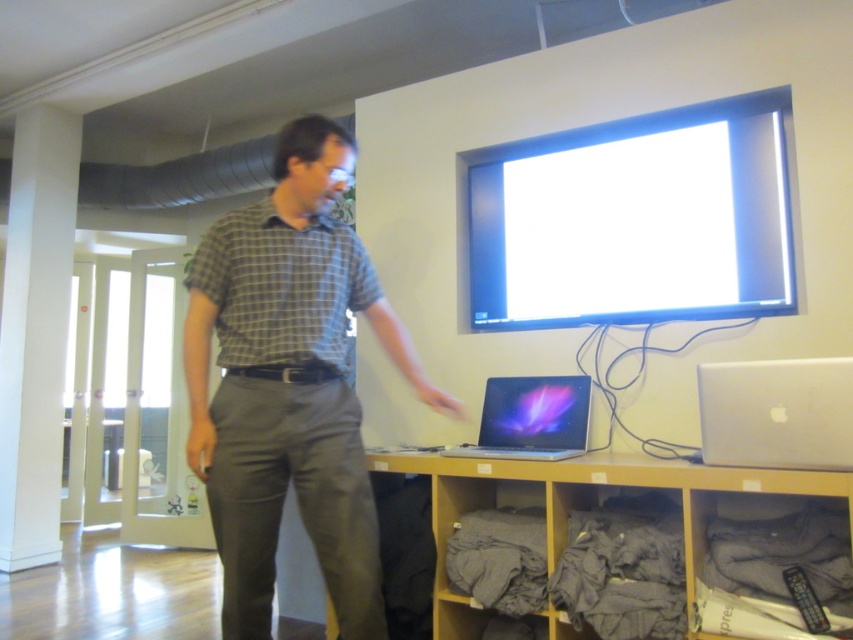
Question: Which point is farther to the camera?

Choices:
 (A) (636, 177)
 (B) (16, 496)
 (C) (547, 452)
 (D) (850, 440)

Answer: (B)

Question: Is plaid shirt at center to the right of white smooth pillar at left from the viewer's perspective?

Choices:
 (A) no
 (B) yes

Answer: (B)

Question: Which object is closer to the camera taking this photo?

Choices:
 (A) glossy plastic laptop at lower center
 (B) plaid shirt at center
 (C) wooden shelf at lower center

Answer: (B)

Question: Is white glossy screen at upper center closer to camera compared to silver metallic laptop at lower right?

Choices:
 (A) yes
 (B) no

Answer: (B)

Question: Which point is farther to the camera?

Choices:
 (A) (15, 340)
 (B) (515, 445)
 (C) (700, 381)
 (D) (543, 493)

Answer: (A)

Question: Can you confirm if white glossy screen at upper center is positioned to the left of silver metallic laptop at lower right?

Choices:
 (A) yes
 (B) no

Answer: (A)